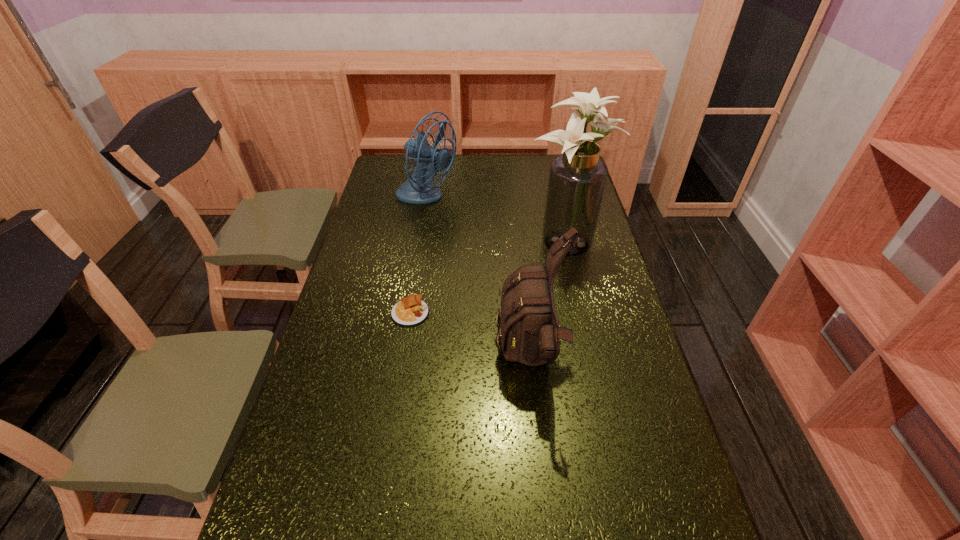
At what (x,y) coordinates should I click in order to perform the action: click on the third nearest object. Please return your answer as a coordinate pair (x, y). Looking at the image, I should click on (577, 178).

The width and height of the screenshot is (960, 540). I want to click on flower arrangement, so click(577, 178).

Locate an element on the screen. the farthest object is located at coordinates (415, 190).

Locate an element on the screen. shoulder bag is located at coordinates (530, 333).

I want to click on omelet, so click(411, 311).

The width and height of the screenshot is (960, 540). In order to click on blank space located 0.220m on the left of the tallest object in this screenshot , I will do `click(464, 243)`.

The image size is (960, 540). I want to click on vacant space located 0.170m in front of the farthest object to blow air, so click(500, 199).

Image resolution: width=960 pixels, height=540 pixels. What are the coordinates of `free space located 0.080m on the front-facing side of the shoulder bag` in the screenshot? It's located at (467, 360).

The image size is (960, 540). Find the location of `vacant position located on the front-facing side of the shoulder bag`. vacant position located on the front-facing side of the shoulder bag is located at coordinates (429, 360).

Find the location of `free space located on the front-facing side of the shoulder bag`. free space located on the front-facing side of the shoulder bag is located at coordinates (367, 360).